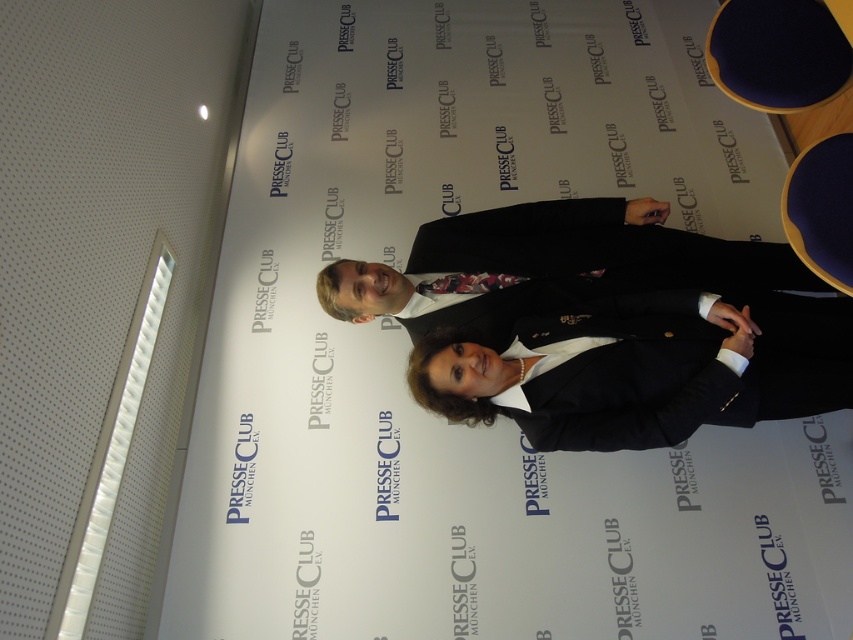
Question: Which of the following is the closest to the observer?

Choices:
 (A) floral silk tie at center
 (B) dark suit at center

Answer: (B)

Question: Can you confirm if black satin blazer at center is thinner than dark suit at center?

Choices:
 (A) no
 (B) yes

Answer: (B)

Question: Is black satin blazer at center positioned before dark suit at center?

Choices:
 (A) yes
 (B) no

Answer: (A)

Question: Among these points, which one is farthest from the camera?

Choices:
 (A) (430, 284)
 (B) (537, 241)
 (C) (817, 371)

Answer: (B)

Question: Which object is positioned farthest from the floral silk tie at center?

Choices:
 (A) dark suit at center
 (B) black satin blazer at center

Answer: (B)

Question: Is black satin blazer at center thinner than dark suit at center?

Choices:
 (A) yes
 (B) no

Answer: (A)